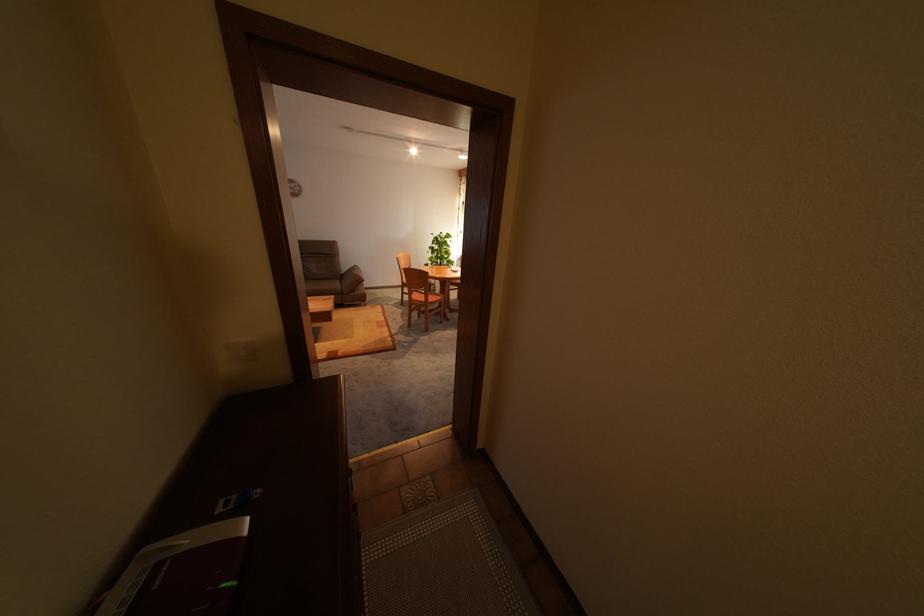
You are a GUI agent. You are given a task and a screenshot of the screen. Output one action in this format:
    pyautogui.click(x=<x>, y=<y>)
    Task: Click on the brown sofa armrest
    
    Given the screenshot: What is the action you would take?
    pyautogui.click(x=350, y=278)